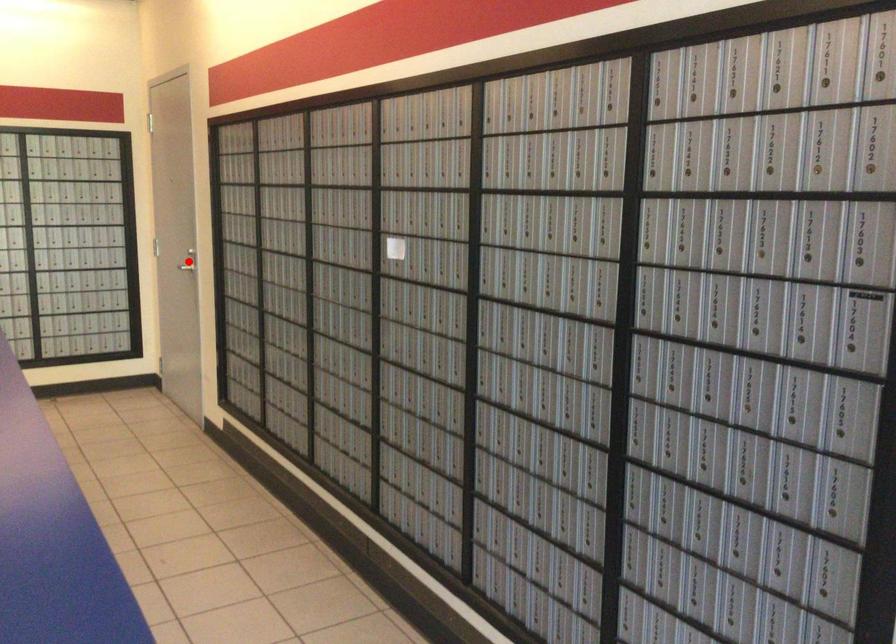
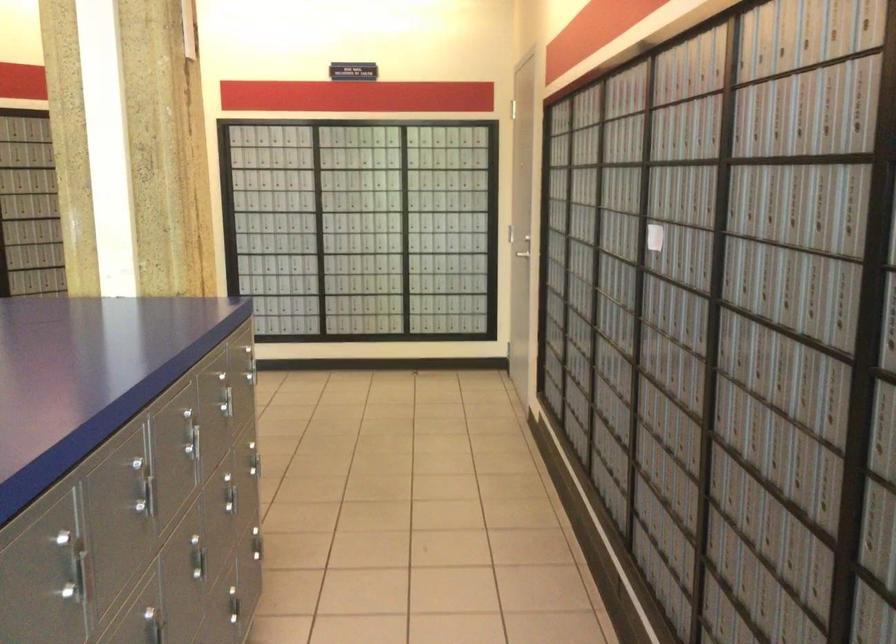
Question: I am providing you with two images of the same scene from different viewpoints. A red point is marked on the first image. Can you still see the location of the red point in image 2?

Choices:
 (A) Yes
 (B) No

Answer: (B)